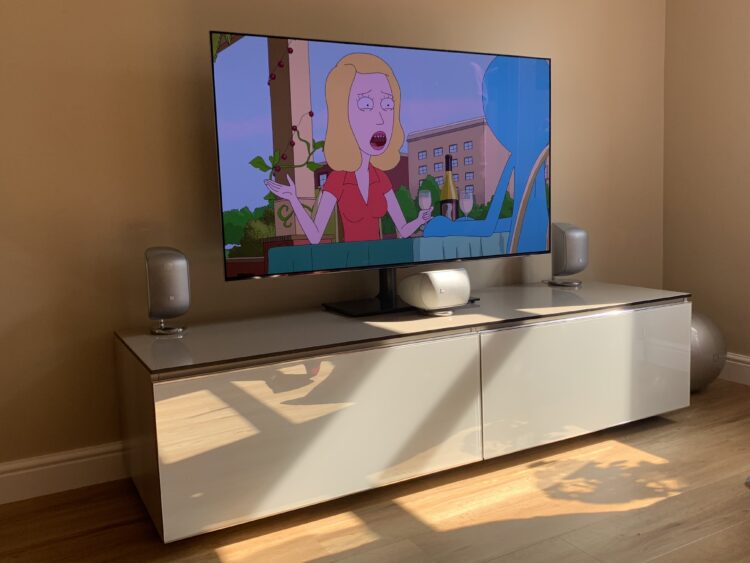
This screenshot has height=563, width=750. I want to click on cupboard doors, so click(x=406, y=383), click(x=558, y=357).